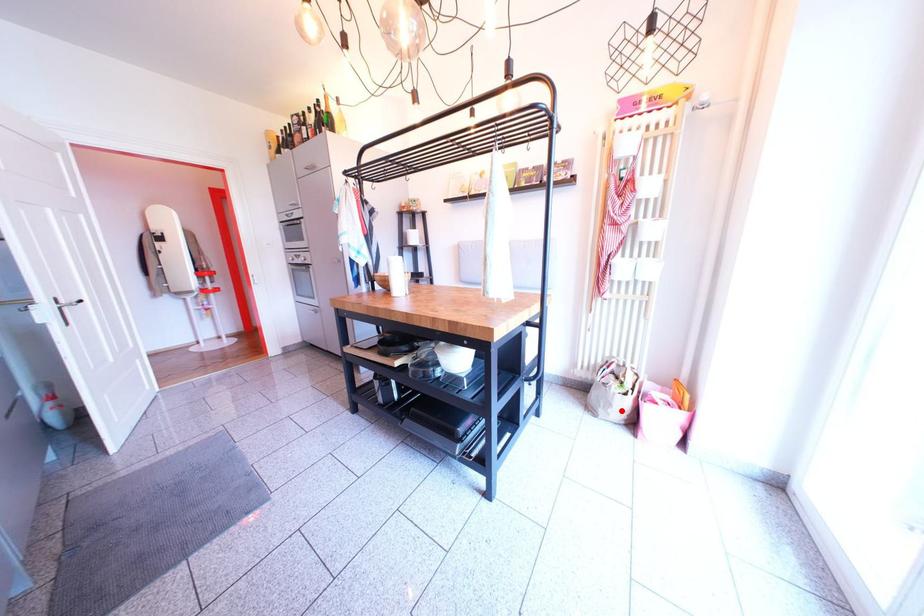
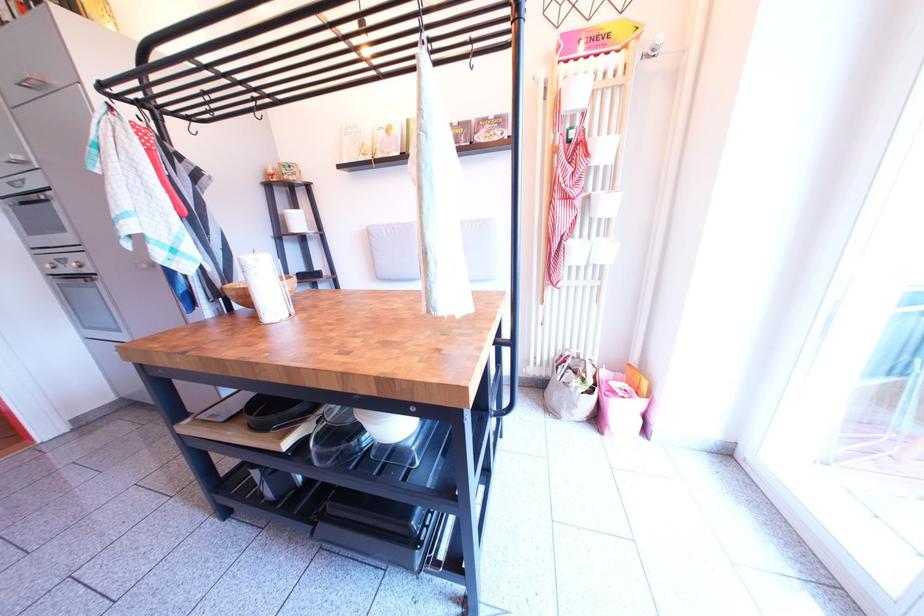
Question: I am providing you with two images of the same scene from different viewpoints. A red point is marked on the first image. Is the red point's position out of view in image 2?

Choices:
 (A) Yes
 (B) No

Answer: (B)